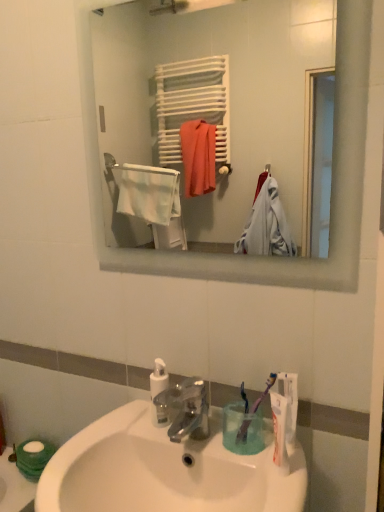
Question: Considering the relative sizes of white glossy sink at lower center and white matte towel rack at upper center in the image provided, is white glossy sink at lower center smaller than white matte towel rack at upper center?

Choices:
 (A) yes
 (B) no

Answer: (B)

Question: From a real-world perspective, is white glossy sink at lower center physically below white matte towel rack at upper center?

Choices:
 (A) no
 (B) yes

Answer: (B)

Question: Is white glossy sink at lower center in front of white matte towel rack at upper center?

Choices:
 (A) no
 (B) yes

Answer: (B)

Question: Is white glossy sink at lower center to the right of white matte towel rack at upper center from the viewer's perspective?

Choices:
 (A) yes
 (B) no

Answer: (B)

Question: Is white glossy sink at lower center facing away from white matte towel rack at upper center?

Choices:
 (A) yes
 (B) no

Answer: (B)

Question: From the image's perspective, is white matte toilet paper at lower left above or below purple plastic toothbrush at lower right, the second toothbrush when ordered from left to right?

Choices:
 (A) below
 (B) above

Answer: (A)

Question: Based on their sizes in the image, would you say white matte toilet paper at lower left is bigger or smaller than purple plastic toothbrush at lower right, the second toothbrush when ordered from left to right?

Choices:
 (A) big
 (B) small

Answer: (A)

Question: Considering the positions of point (39, 465) and point (248, 411), is point (39, 465) closer or farther from the camera than point (248, 411)?

Choices:
 (A) farther
 (B) closer

Answer: (A)

Question: In terms of height, does white matte toilet paper at lower left look taller or shorter compared to purple plastic toothbrush at lower right, positioned as the first toothbrush in right-to-left order?

Choices:
 (A) short
 (B) tall

Answer: (A)

Question: In terms of height, does purple plastic toothbrush at lower right, positioned as the first toothbrush in right-to-left order, look taller or shorter compared to white matte toothpaste at lower right?

Choices:
 (A) tall
 (B) short

Answer: (B)

Question: In terms of size, does purple plastic toothbrush at lower right, the second toothbrush when ordered from left to right, appear bigger or smaller than white matte toothpaste at lower right?

Choices:
 (A) big
 (B) small

Answer: (A)

Question: From a real-world perspective, is purple plastic toothbrush at lower right, the second toothbrush when ordered from left to right, physically located above or below white matte toothpaste at lower right?

Choices:
 (A) below
 (B) above

Answer: (A)

Question: Which is correct: purple plastic toothbrush at lower right, the second toothbrush when ordered from left to right, is inside white matte toothpaste at lower right, or outside of it?

Choices:
 (A) outside
 (B) inside

Answer: (A)

Question: Choose the correct answer: Is purple plastic toothbrush at lower center, which is the 1th toothbrush from left to right, inside white glossy sink at lower center or outside it?

Choices:
 (A) outside
 (B) inside

Answer: (A)

Question: Looking at the image, does purple plastic toothbrush at lower center, which ranks as the 2th toothbrush in right-to-left order, seem bigger or smaller compared to white glossy sink at lower center?

Choices:
 (A) small
 (B) big

Answer: (A)